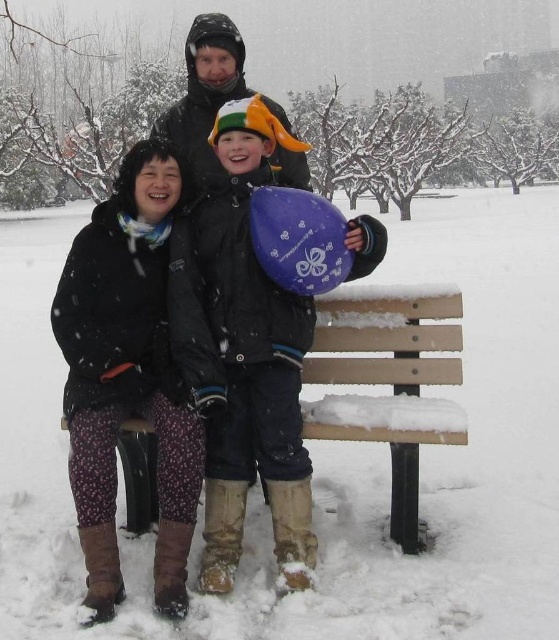
Based on the photo, you are a photographer trying to capture a photo of the purple matte balloon at center and the matte black jacket at upper center. Which object should you zoom in on to ensure both are in focus?

The purple matte balloon at center is smaller than the matte black jacket at upper center, so you should zoom in on the purple matte balloon at center to ensure both are in focus.